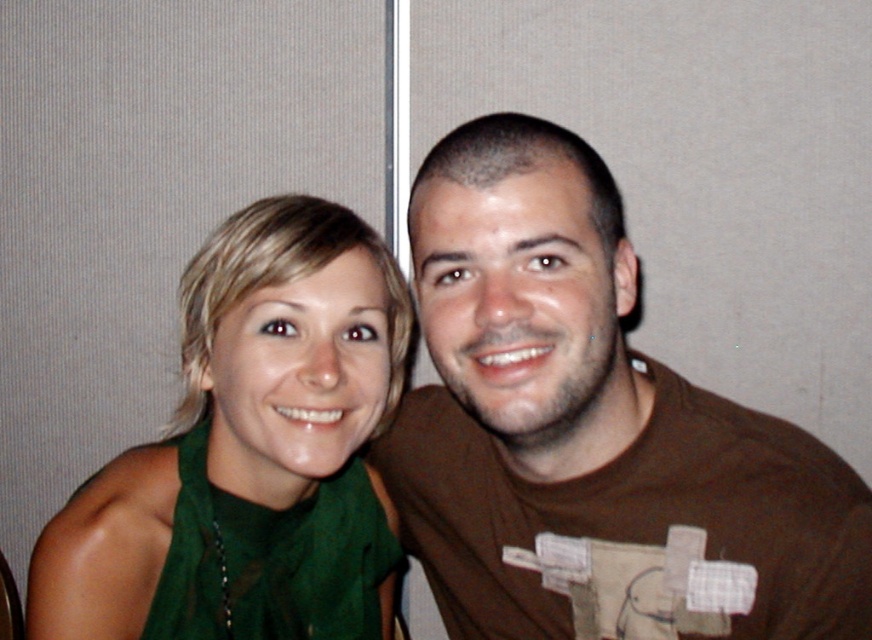
Is brown cotton t-shirt at center behind green matte scarf at left?

That is False.

This screenshot has width=872, height=640. What do you see at coordinates (591, 432) in the screenshot? I see `brown cotton t-shirt at center` at bounding box center [591, 432].

Where is `brown cotton t-shirt at center`? The image size is (872, 640). brown cotton t-shirt at center is located at coordinates (591, 432).